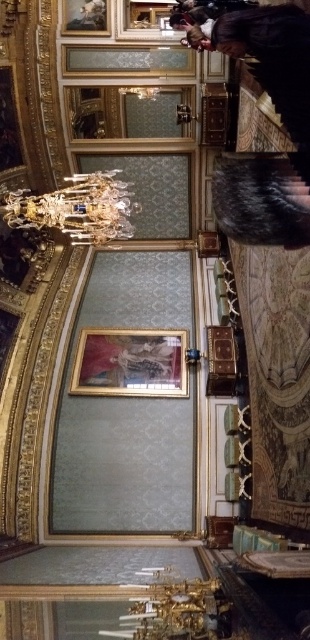
Question: Which object is closer to the camera taking this photo?

Choices:
 (A) crystal glass chandelier at upper center
 (B) gold/gilded picture frame at upper center

Answer: (A)

Question: Based on their relative distances, which object is nearer to the gold-framed painting at center?

Choices:
 (A) crystal glass chandelier at upper center
 (B) gold/gilded picture frame at upper center

Answer: (A)

Question: Which object appears closest to the camera in this image?

Choices:
 (A) crystal glass chandelier at upper center
 (B) gold-framed painting at center

Answer: (A)

Question: Observing the image, what is the correct spatial positioning of gold-framed painting at center in reference to gold/gilded picture frame at upper center?

Choices:
 (A) right
 (B) left

Answer: (A)

Question: Is gold-framed painting at center closer to camera compared to gold/gilded picture frame at upper center?

Choices:
 (A) yes
 (B) no

Answer: (A)

Question: Can you confirm if crystal glass chandelier at upper center is positioned to the left of gold/gilded picture frame at upper center?

Choices:
 (A) no
 (B) yes

Answer: (B)